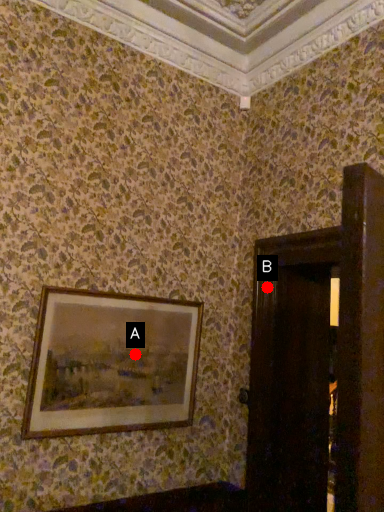
Question: Two points are circled on the image, labeled by A and B beside each circle. Which point is closer to the camera?

Choices:
 (A) A is closer
 (B) B is closer

Answer: (A)